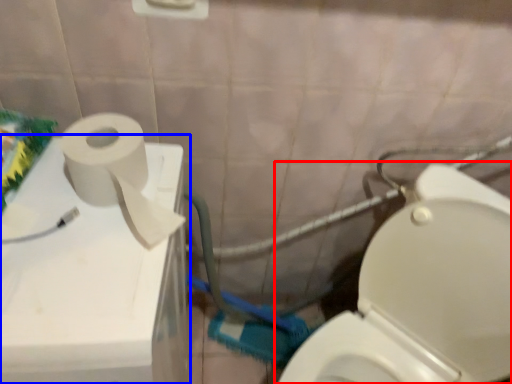
Question: Which of the following is the farthest to the observer, toilet (highlighted by a red box) or appliance (highlighted by a blue box)?

Choices:
 (A) toilet
 (B) appliance

Answer: (B)